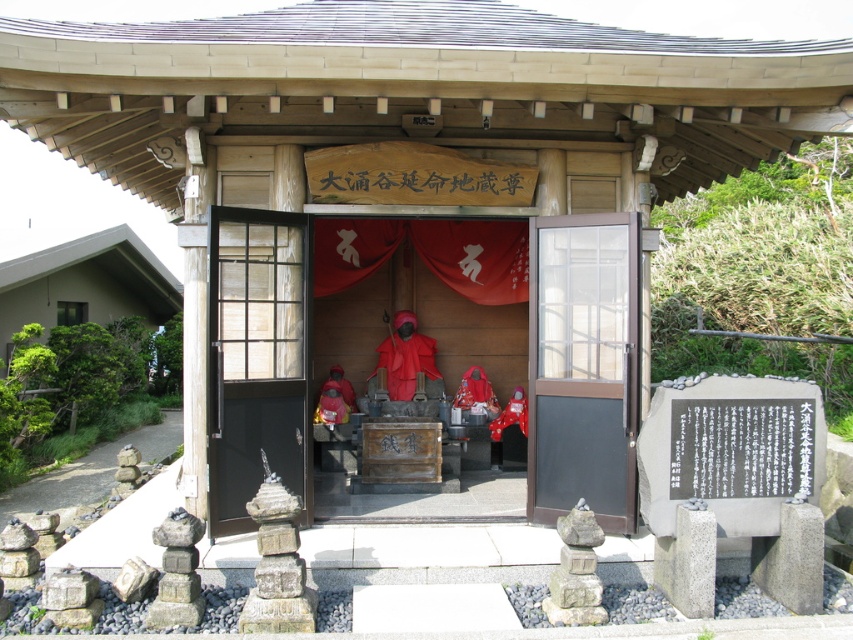
You are standing in front of the shrine and want to enter through the entrance. Where is the black glass door at center located in the shrine?

The black glass door at center is located at point (254, 356).

In the scene shown: You are a visitor approaching the shrine and want to see the matte red statue at center. Can you see it through the brown wooden door at center from your current position outside?

The brown wooden door at center is in front of matte red statue at center, so yes, you can see the matte red statue at center through the brown wooden door at center if the doors are open.